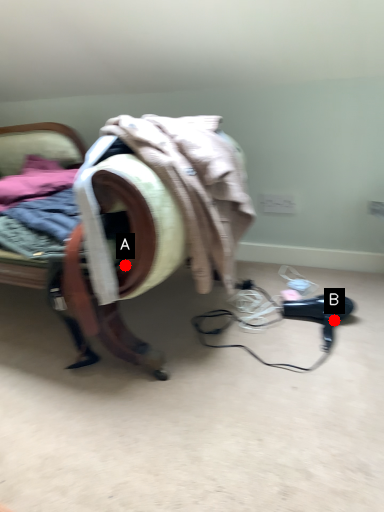
Question: Two points are circled on the image, labeled by A and B beside each circle. Which of the following is the closest to the observer?

Choices:
 (A) A is closer
 (B) B is closer

Answer: (A)